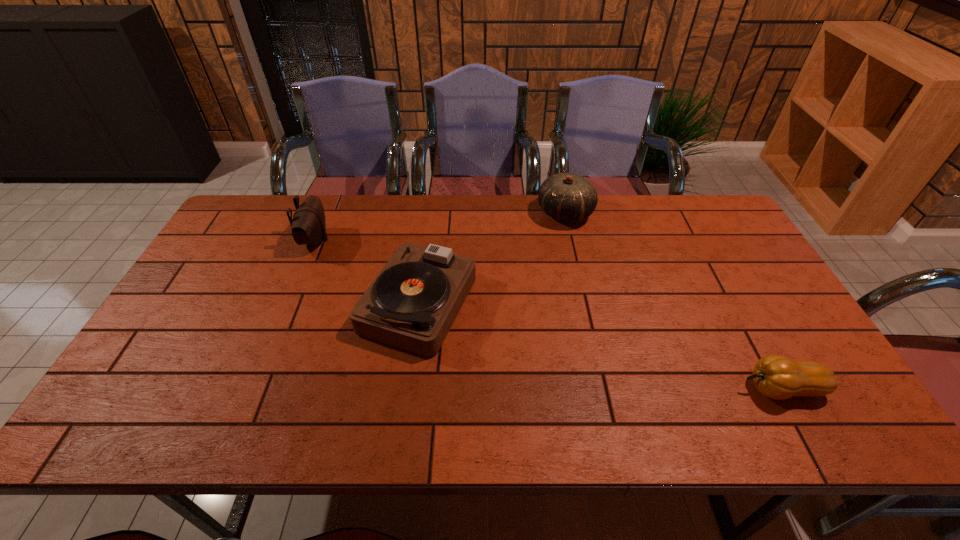
Where is `the farther gourd`? The height and width of the screenshot is (540, 960). the farther gourd is located at coordinates (568, 197).

Identify the location of the taller gourd. Image resolution: width=960 pixels, height=540 pixels. pos(568,197).

Where is `the leftmost object`? the leftmost object is located at coordinates (308, 226).

Locate an element on the screen. the third object from right to left is located at coordinates (412, 303).

In order to click on the shorter gourd in this screenshot , I will do `click(775, 376)`.

Image resolution: width=960 pixels, height=540 pixels. What are the coordinates of `the nearest object` in the screenshot? It's located at (775, 376).

The width and height of the screenshot is (960, 540). I want to click on free space located on the right of the taller gourd, so click(x=640, y=213).

The image size is (960, 540). What are the coordinates of `free space located with the flap open on the leftmost object` in the screenshot? It's located at (420, 240).

Identify the location of vacant space situated on the right of the record player. (584, 302).

The width and height of the screenshot is (960, 540). Find the location of `free region located on the stem side of the rightmost object`. free region located on the stem side of the rightmost object is located at coordinates coord(701,389).